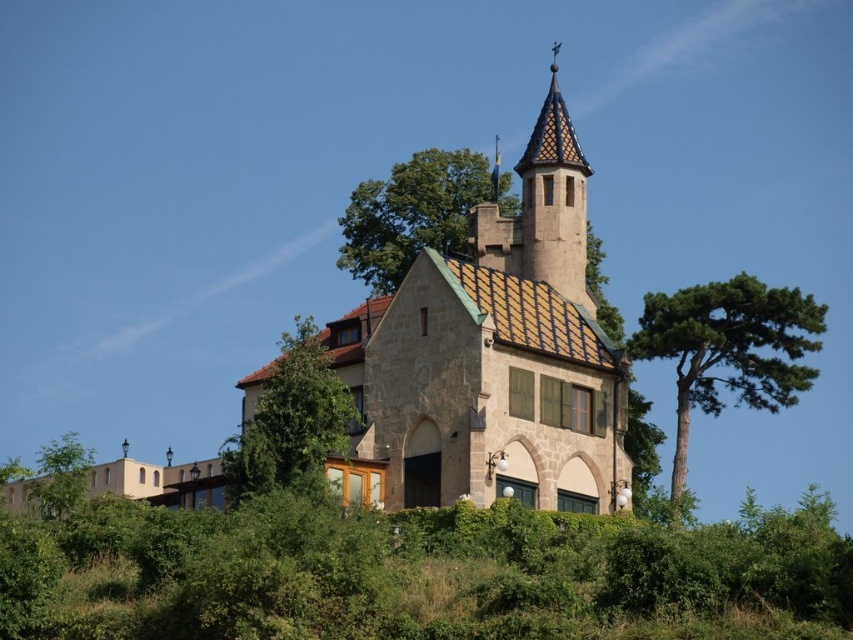
Based on the photo, is the position of brown stone church at center more distant than that of glazed ceramic spire at upper center?

That is False.

Which is more to the right, brown stone church at center or glazed ceramic spire at upper center?

Positioned to the right is glazed ceramic spire at upper center.

Which is in front, point (450, 289) or point (520, 252)?

Positioned in front is point (450, 289).

The image size is (853, 640). What are the coordinates of `brown stone church at center` in the screenshot? It's located at (492, 356).

In the scene shown: Is green leafy tree at upper center to the right of glazed ceramic spire at upper center from the viewer's perspective?

In fact, green leafy tree at upper center is to the left of glazed ceramic spire at upper center.

Does point (376, 180) come in front of point (558, 225)?

That is False.

Find the location of a particular element. Image resolution: width=853 pixels, height=640 pixels. green leafy tree at upper center is located at coordinates (415, 212).

Is green leafy tree at upper center to the right of green leafy tree at center from the viewer's perspective?

Correct, you'll find green leafy tree at upper center to the right of green leafy tree at center.

The height and width of the screenshot is (640, 853). Describe the element at coordinates (415, 212) in the screenshot. I see `green leafy tree at upper center` at that location.

Does point (496, 195) come farther from viewer compared to point (273, 465)?

Yes, it is.

What are the coordinates of `green leafy tree at upper center` in the screenshot? It's located at (415, 212).